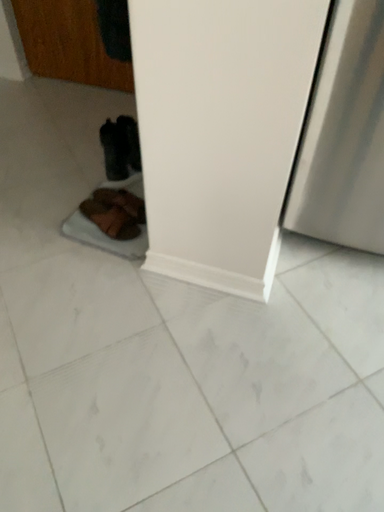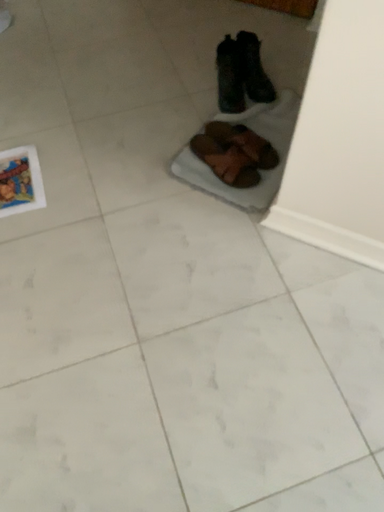
Question: Which way did the camera rotate in the video?

Choices:
 (A) rotated downward
 (B) rotated upward

Answer: (A)